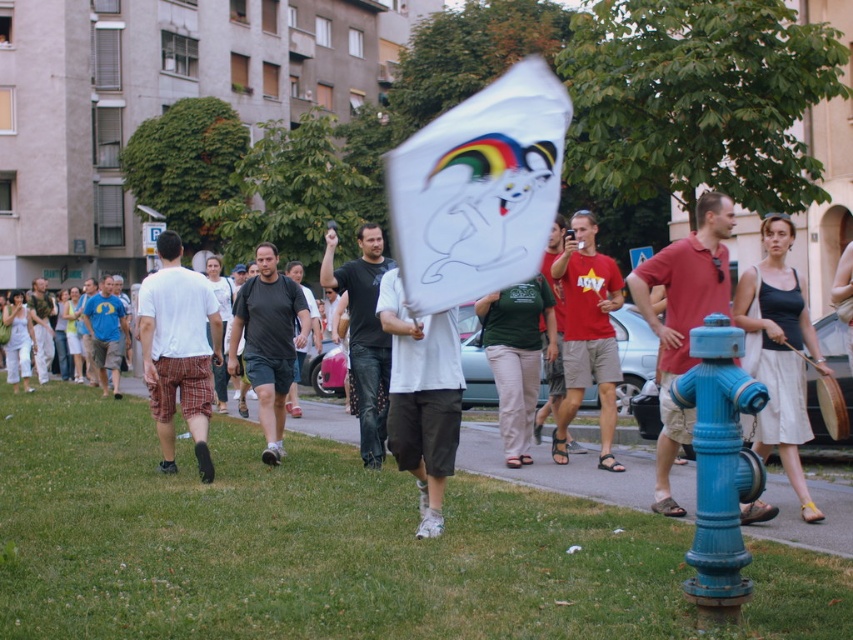
Question: Where is white cotton t-shirt at left located in relation to black cotton t-shirt at center in the image?

Choices:
 (A) above
 (B) below

Answer: (A)

Question: In this image, where is black cotton t-shirt at center located relative to camouflage pants at center?

Choices:
 (A) left
 (B) right

Answer: (B)

Question: Which point appears closest to the camera in this image?

Choices:
 (A) (440, 200)
 (B) (683, 426)
 (C) (567, 310)

Answer: (A)

Question: Which object is farther from the camera taking this photo?

Choices:
 (A) matte red shirt at center
 (B) matte blue t-shirt at left
 (C) white cotton t-shirt at left

Answer: (B)

Question: Which point appears farthest from the camera in this image?

Choices:
 (A) (299, 304)
 (B) (94, 308)
 (C) (395, 268)

Answer: (B)

Question: Can you confirm if white cotton t-shirt at left is bigger than red cotton t-shirt at center?

Choices:
 (A) yes
 (B) no

Answer: (A)